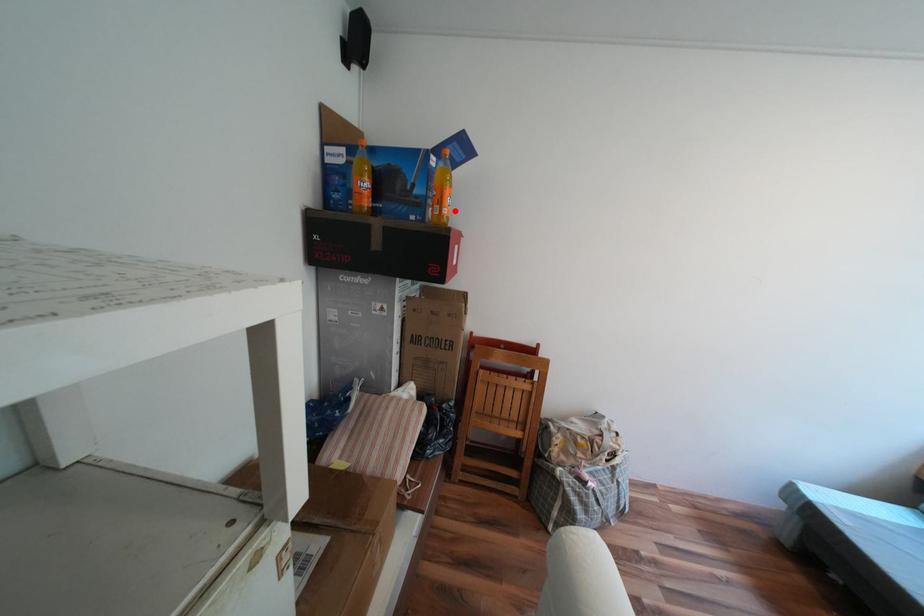
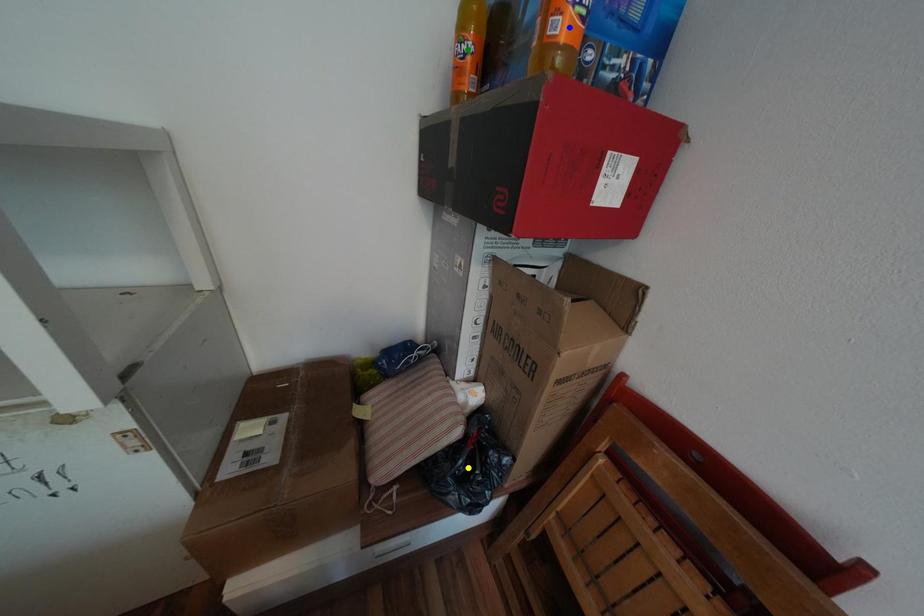
Question: I am providing you with two images of the same scene from different viewpoints. A red point is marked on the first image. You are given multiple points on the second image. Can you choose the point in image 2 that corresponds to the point in image 1?

Choices:
 (A) green point
 (B) blue point
 (C) yellow point

Answer: (B)